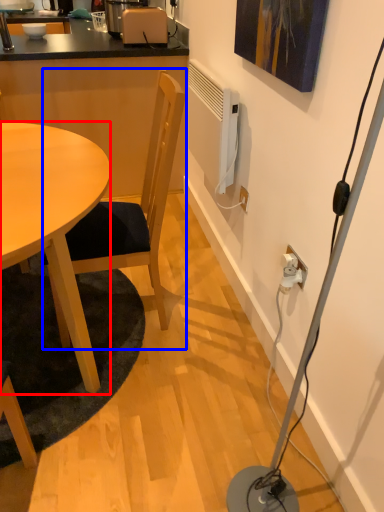
Question: Among these objects, which one is nearest to the camera, desk (highlighted by a red box) or chair (highlighted by a blue box)?

Choices:
 (A) desk
 (B) chair

Answer: (A)